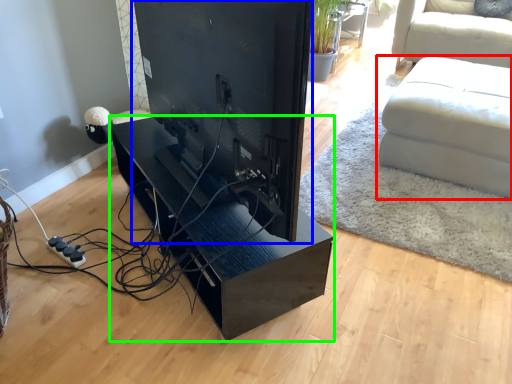
Question: Which object is the closest to the studio couch (highlighted by a red box)? Choose among these: desktop computer (highlighted by a blue box) or table (highlighted by a green box).

Choices:
 (A) desktop computer
 (B) table

Answer: (B)